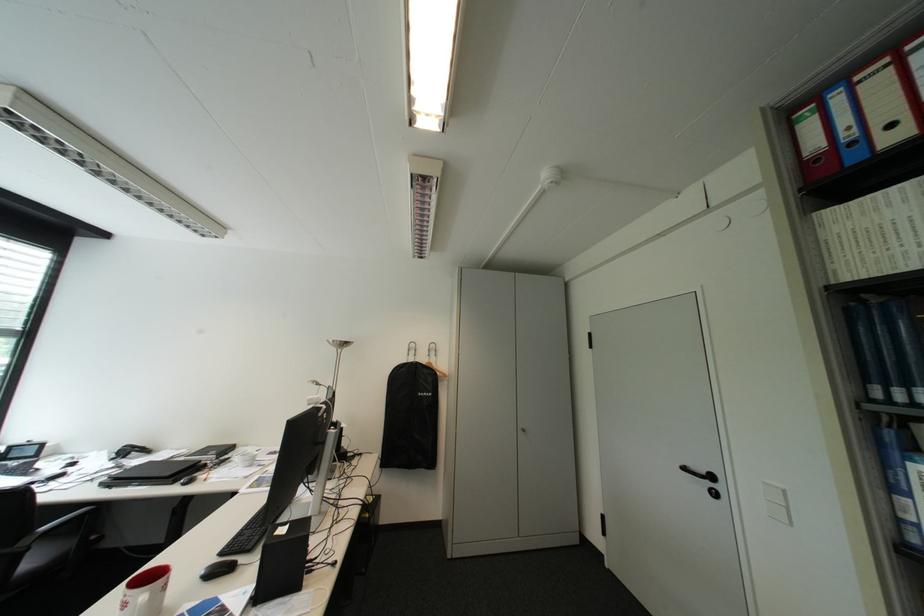
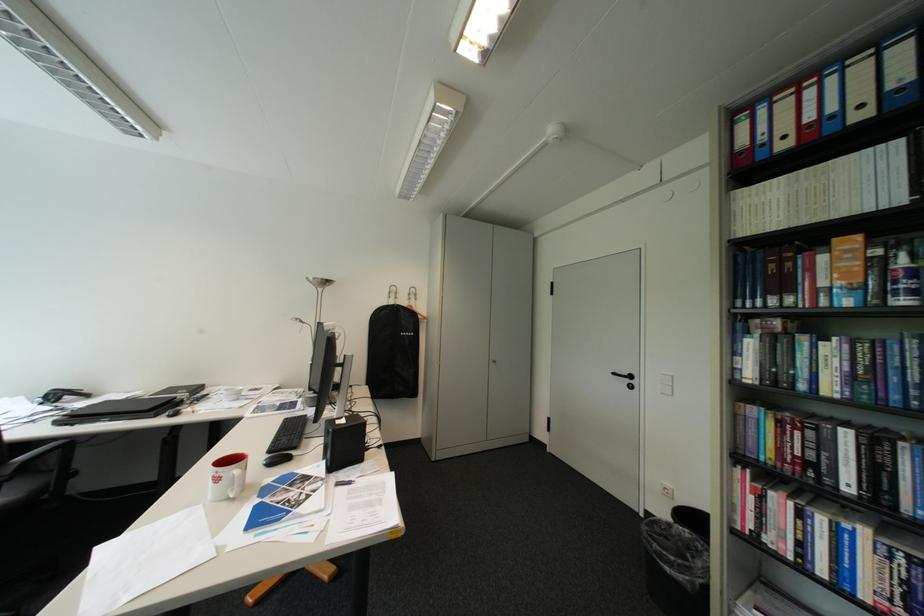
The point at (697, 469) is marked in the first image. Where is the corresponding point in the second image?

(626, 374)